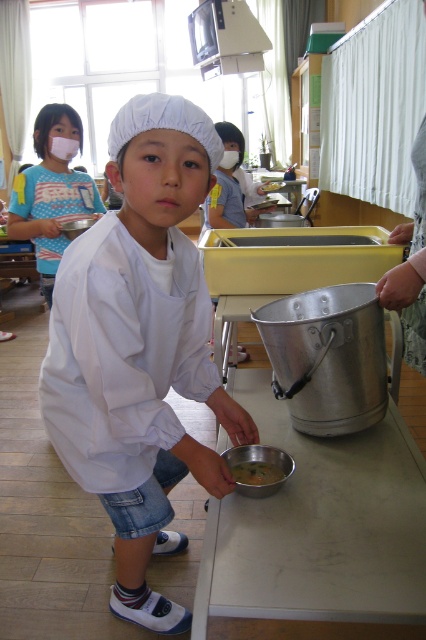
You are a photographer standing in the classroom scene. You need to take a photo that includes both the matte blue shirt at upper left and the metallic silver bucket at right. Which object should you focus on first to ensure both are in frame?

The matte blue shirt at upper left is much taller than the metallic silver bucket at right, so you should focus on the matte blue shirt at upper left first to ensure both are in frame.

You are a child in the classroom and you want to grab the yellow matte bowl at lower center to taste the soup. Which direction should you move to reach it from the metallic silver bowl at lower center?

The yellow matte bowl at lower center is to the right of the metallic silver bowl at lower center, so you should move to your right to reach it.

You are a student in the classroom and need to hand in your assignment to the teacher who is standing near the front. You have two bowls in front of you, the yellow matte bowl at lower center and the metallic silver bowl at lower center. Which bowl should you pick up first if you want to reach the teacher quickly?

The yellow matte bowl at lower center is closer to the viewer than the metallic silver bowl at lower center, so you should pick up the yellow matte bowl at lower center first to reach the teacher quickly.